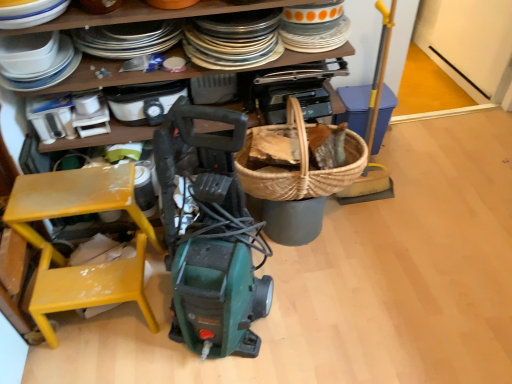
I want to click on free space above white plastic toaster at upper center, the fourth appliance positioned from the left (from a real-world perspective), so click(141, 92).